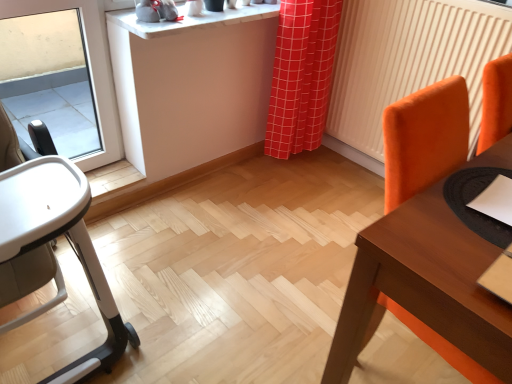
This screenshot has width=512, height=384. Identify the location of vacant space underneath orange fabric radiator at right (from a real-world perspective). (355, 161).